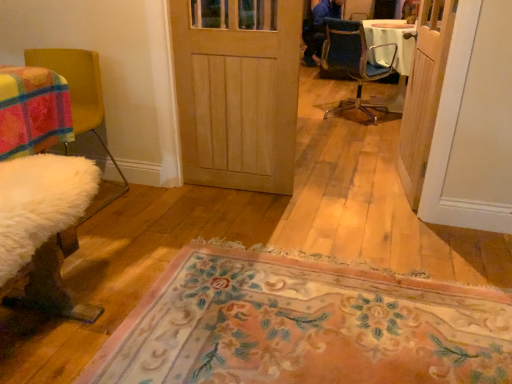
Question: From a real-world perspective, relative to natural wood door at center, positioned as the first door in left-to-right order, is white fluffy chair at left, the first chair when ordered from front to back, vertically above or below?

Choices:
 (A) above
 (B) below

Answer: (B)

Question: Would you say white fluffy chair at left, which is counted as the second chair, starting from the right, is inside or outside natural wood door at center, which appears as the second door when viewed from the right?

Choices:
 (A) outside
 (B) inside

Answer: (A)

Question: Estimate the real-world distances between objects in this image. Which object is farther from the floral carpet at center?

Choices:
 (A) natural wood door at center, positioned as the first door in left-to-right order
 (B) white fluffy chair at left, which is counted as the second chair, starting from the right
 (C) blue fabric chair at center, the 1th chair positioned from the back
 (D) wooden door at right, placed as the 1th door when sorted from right to left

Answer: (C)

Question: Which of these objects is positioned closest to the natural wood door at center, which appears as the second door when viewed from the right?

Choices:
 (A) blue fabric chair at center, the 1th chair positioned from the back
 (B) wooden door at right, placed as the 1th door when sorted from right to left
 (C) floral carpet at center
 (D) white fluffy chair at left, arranged as the second chair when viewed from the back

Answer: (D)